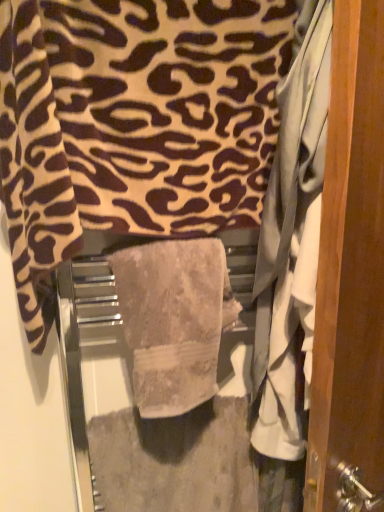
Question: Is beige textured towel at center, acting as the 2th towel starting from the top, in front of or behind wooden door at right in the image?

Choices:
 (A) front
 (B) behind

Answer: (B)

Question: Considering the relative positions of beige textured towel at center, which is counted as the first towel, starting from the bottom, and wooden door at right in the image provided, is beige textured towel at center, which is counted as the first towel, starting from the bottom, to the left or to the right of wooden door at right?

Choices:
 (A) right
 (B) left

Answer: (B)

Question: Which object is the farthest from the beige textured towel at center, arranged as the 1th towel when viewed from the top?

Choices:
 (A) wooden door at right
 (B) beige textured towel at center, acting as the 2th towel starting from the top

Answer: (A)

Question: Considering the real-world distances, which object is closest to the wooden door at right?

Choices:
 (A) beige textured towel at center, which is counted as the first towel, starting from the bottom
 (B) beige textured towel at center, arranged as the 1th towel when viewed from the top

Answer: (A)